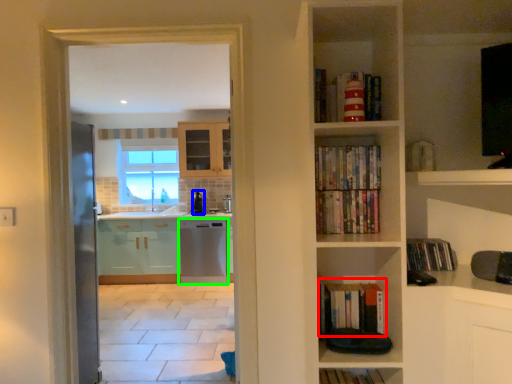
Question: Which object is the closest to the book (highlighted by a red box)? Choose among these: appliance (highlighted by a blue box) or dish washer (highlighted by a green box).

Choices:
 (A) appliance
 (B) dish washer

Answer: (B)